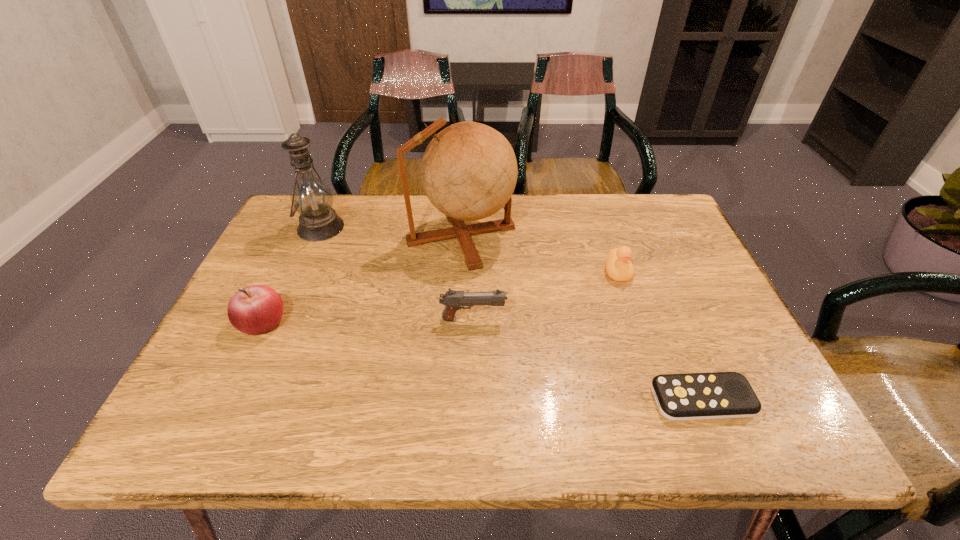
Locate an element on the screen. The width and height of the screenshot is (960, 540). free space that is in between the tallest object and the duck is located at coordinates (540, 253).

Locate an element on the screen. This screenshot has width=960, height=540. free spot between the globe and the apple is located at coordinates (362, 279).

Where is `empty space between the remote control and the gun`? This screenshot has width=960, height=540. empty space between the remote control and the gun is located at coordinates (588, 359).

This screenshot has height=540, width=960. I want to click on vacant space in between the second tallest object and the tallest object, so click(x=391, y=231).

Identify the location of unoccupied area between the tallest object and the remote control. (582, 317).

Locate which object is the second closest to the tallest object. Please provide its 2D coordinates. Your answer should be formatted as a tuple, i.e. [(x, y)], where the tuple contains the x and y coordinates of a point satisfying the conditions above.

[(312, 198)]

The image size is (960, 540). I want to click on object that ranks as the fifth closest to the duck, so click(x=253, y=310).

I want to click on free space that satisfies the following two spatial constraints: 1. on the face of the duck; 2. on the left side of the nearest object, so click(x=660, y=399).

At what (x,y) coordinates should I click in order to perform the action: click on vacant area in the image that satisfies the following two spatial constraints: 1. on the front side of the shortest object; 2. on the right side of the second tallest object. Please return your answer as a coordinate pair (x, y). Looking at the image, I should click on (245, 399).

You are a GUI agent. You are given a task and a screenshot of the screen. Output one action in this format:
    pyautogui.click(x=<x>, y=<y>)
    Task: Click on the vacant space that satisfies the following two spatial constraints: 1. on the face of the duck; 2. in the direction the gun is aimed
    The width and height of the screenshot is (960, 540).
    Given the screenshot: What is the action you would take?
    pyautogui.click(x=634, y=319)